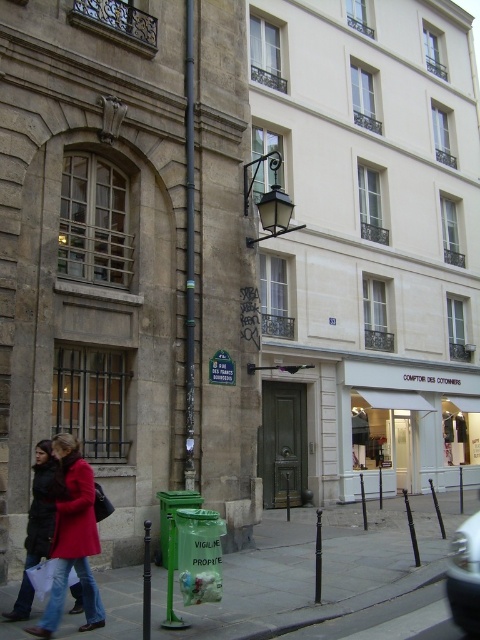
Question: Which of the following is the farthest from the observer?

Choices:
 (A) (190, 406)
 (B) (44, 484)
 (C) (228, 362)
 (D) (121, 634)

Answer: (C)

Question: Is metallic silver car at lower right to the left of green plastic sign at center from the viewer's perspective?

Choices:
 (A) no
 (B) yes

Answer: (A)

Question: Which of the following is the farthest from the observer?

Choices:
 (A) (187, 168)
 (B) (36, 500)
 (C) (256, 538)
 (D) (277, 156)

Answer: (D)

Question: Is green plastic pole at center above black metal streetlight at upper center?

Choices:
 (A) yes
 (B) no

Answer: (B)

Question: Among these points, which one is farthest from the camera?

Choices:
 (A) (283, 228)
 (B) (82, 602)
 (C) (191, 67)
 (D) (457, 588)

Answer: (A)

Question: Is matte red coat at lower left smaller than black metal streetlight at upper center?

Choices:
 (A) no
 (B) yes

Answer: (B)